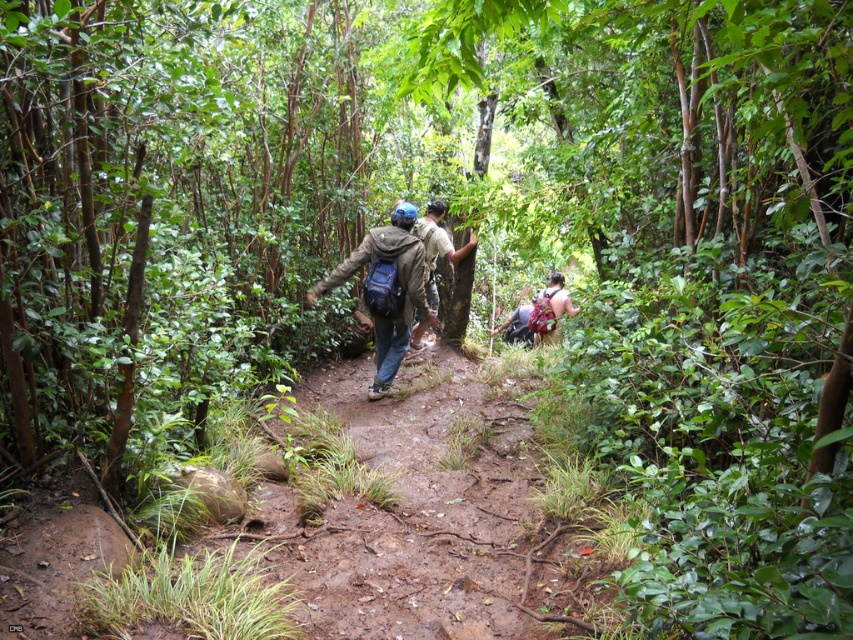
You are a hiker planning to join the group in the forest. You see the point marked as point [386,291]. What object does this point correspond to?

The point [386,291] corresponds to the matte green jacket at center.

You are planning to take a photo of the matte green jacket at center and the matte blue backpack at center in the forest scene. Which object should you focus on first if you want to capture both in a single frame without moving the camera, considering their sizes?

The matte green jacket at center has a larger size compared to the matte blue backpack at center. Therefore, you should focus on the matte green jacket at center first to ensure it fits well within the frame, then adjust the composition to include the smaller matte blue backpack at center without moving the camera.